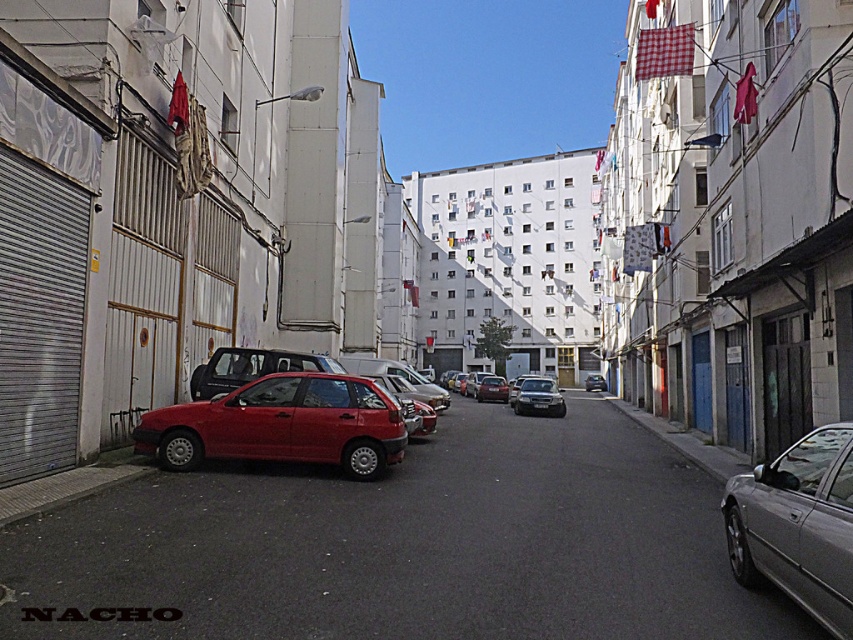
Question: Which point is closer to the camera taking this photo?

Choices:
 (A) pyautogui.click(x=451, y=609)
 (B) pyautogui.click(x=589, y=385)

Answer: (A)

Question: Does silver metallic sedan at right have a greater width compared to matte red car at center?

Choices:
 (A) no
 (B) yes

Answer: (A)

Question: Among these points, which one is nearest to the camera?

Choices:
 (A) (827, 452)
 (B) (543, 400)

Answer: (A)

Question: Which point is farther to the camera?

Choices:
 (A) (474, 397)
 (B) (810, 524)
 (C) (344, 468)
 (D) (532, 403)

Answer: (A)

Question: Does glossy metallic car at center appear on the left side of metallic silver sedan at center?

Choices:
 (A) yes
 (B) no

Answer: (B)

Question: Is glossy metallic car at center above matte red car at center?

Choices:
 (A) yes
 (B) no

Answer: (A)